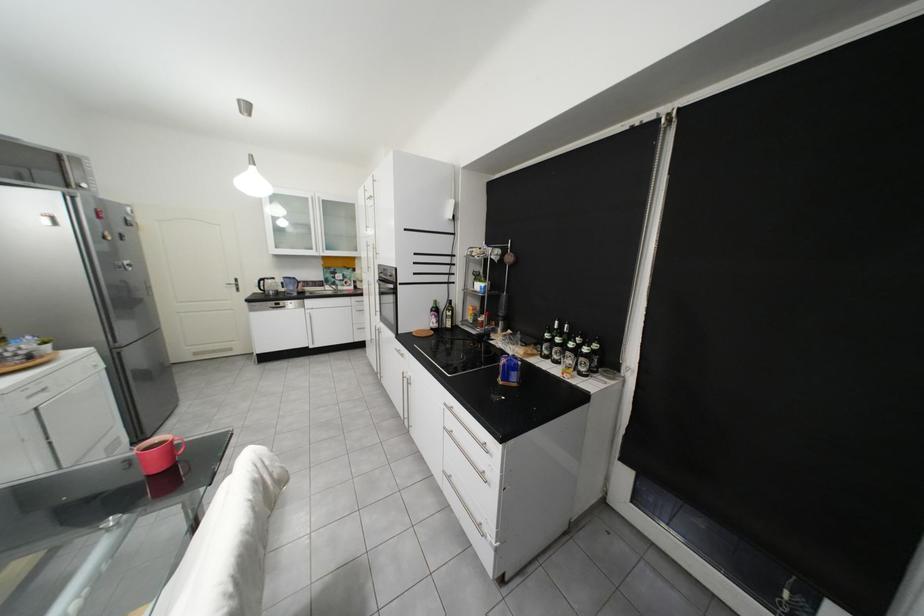
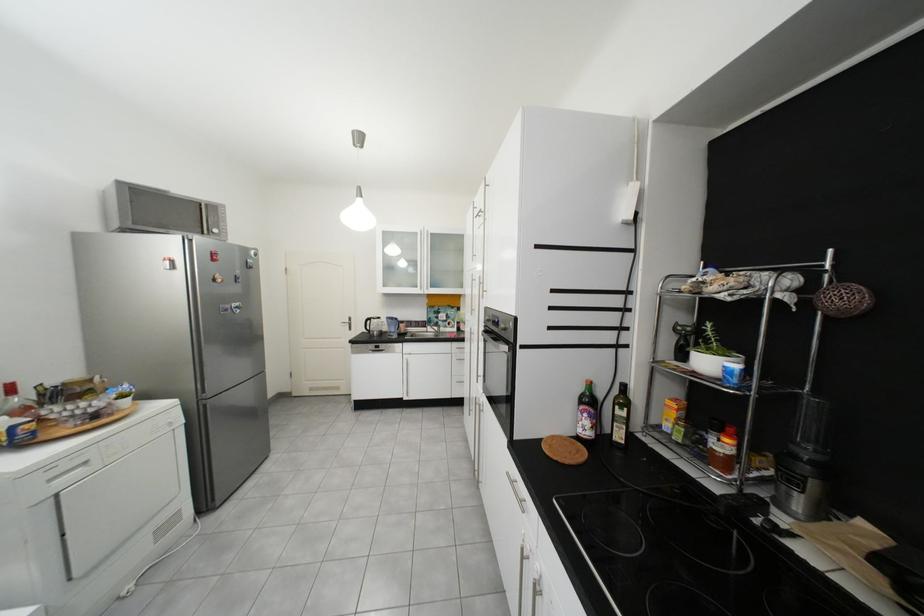
In the second image, find the point that corresponds to (x=67, y=225) in the first image.

(185, 269)